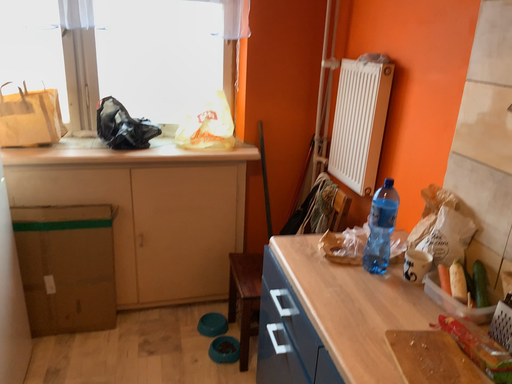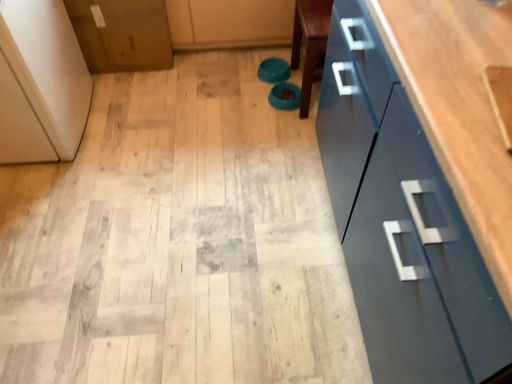
Question: How did the camera likely rotate when shooting the video?

Choices:
 (A) rotated upward
 (B) rotated downward

Answer: (B)